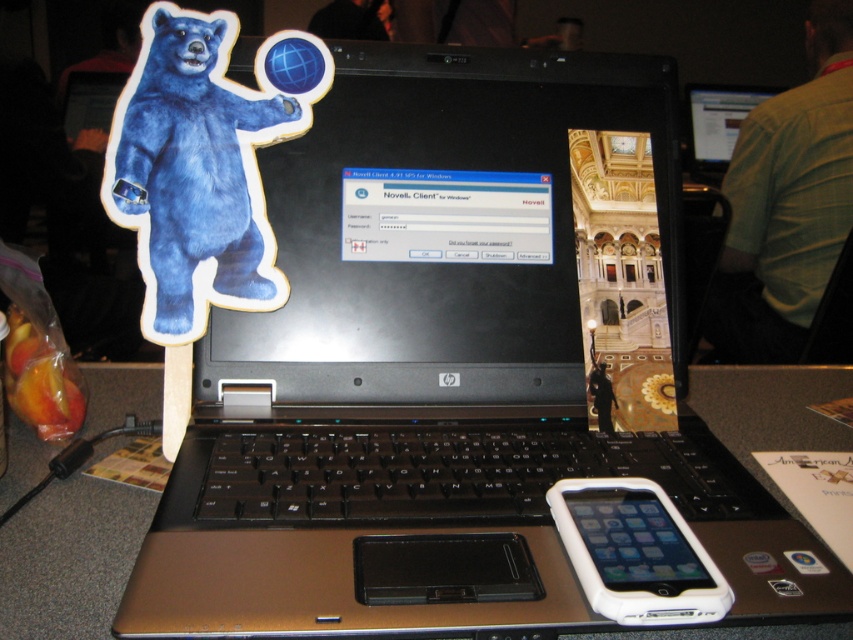
Where is the fuzzy blue bear at left located in the image?

The fuzzy blue bear at left is located at point (x=198, y=170).

Consider the image. You are standing in front of the table with the laptop and need to place a small item exactly at the point marked as point (68, 557). Based on the scene description, where should you place the item relative to the laptop?

The point (68, 557) is located on the metallic gray table at center, so you should place the item on the metallic gray table at center where the laptop is placed.

You are organizing items on a table and need to place a new item between the fuzzy blue bear at left and the white plastic ipod at center. Based on their sizes, which side should you place the new item closer to?

Since the fuzzy blue bear at left is wider than the white plastic ipod at center, you should place the new item closer to the white plastic ipod at center to maintain balance between the two objects.